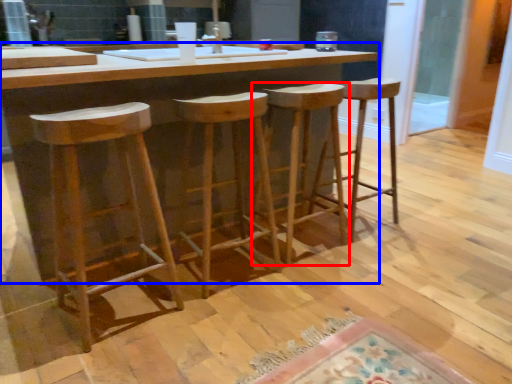
Question: Which object is further to the camera taking this photo, stool (highlighted by a red box) or table (highlighted by a blue box)?

Choices:
 (A) stool
 (B) table

Answer: (A)